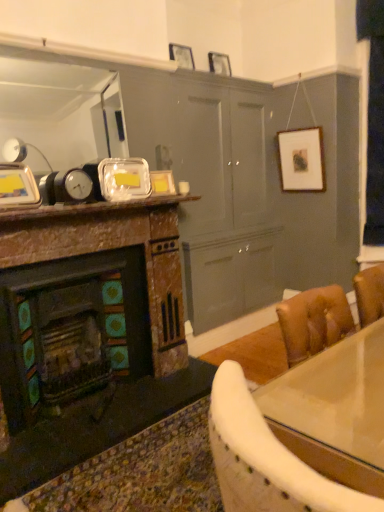
Describe the element at coordinates (88, 300) in the screenshot. I see `rustic stone fireplace at left` at that location.

The image size is (384, 512). I want to click on rustic stone fireplace at left, so click(x=88, y=300).

What do you see at coordinates (183, 188) in the screenshot?
I see `white glossy coffee cup at center` at bounding box center [183, 188].

What is the approximate width of wooden picture frame at upper center, arranged as the 3th picture frame when viewed from the left?

wooden picture frame at upper center, arranged as the 3th picture frame when viewed from the left, is 2.19 inches in width.

What do you see at coordinates (162, 182) in the screenshot? This screenshot has height=512, width=384. I see `matte glass picture frame at upper center, the second picture frame when ordered from front to back` at bounding box center [162, 182].

This screenshot has height=512, width=384. I want to click on shiny glass table at lower right, so click(x=335, y=396).

Considering the relative positions of rustic stone fireplace at left and shiny glass table at lower right in the image provided, is rustic stone fireplace at left to the left of shiny glass table at lower right from the viewer's perspective?

Indeed, rustic stone fireplace at left is positioned on the left side of shiny glass table at lower right.

Which object is further away from the camera taking this photo, rustic stone fireplace at left or shiny glass table at lower right?

rustic stone fireplace at left is more distant.

Looking at this image, is rustic stone fireplace at left looking in the opposite direction of shiny glass table at lower right?

rustic stone fireplace at left does not have its back to shiny glass table at lower right.

Identify the location of cabinetry that is under the shiny glass table at lower right (from a real-world perspective). (88, 300).

From a real-world perspective, is matte glass picture frame at upper center, marked as the fourth picture frame in a right-to-left arrangement, physically above white glossy coffee cup at center?

Yes, from a real-world perspective, matte glass picture frame at upper center, marked as the fourth picture frame in a right-to-left arrangement, is on top of white glossy coffee cup at center.

How many degrees apart are the facing directions of matte glass picture frame at upper center, marked as the second picture frame in a bottom-to-top arrangement, and white glossy coffee cup at center?

There is a 17.9-degree angle between the facing directions of matte glass picture frame at upper center, marked as the second picture frame in a bottom-to-top arrangement, and white glossy coffee cup at center.

Is point (156, 180) more distant than point (182, 184)?

No, it is not.

In the scene shown: Is matte glass picture frame at upper center, which is counted as the 4th picture frame, starting from the top, inside or outside of white glossy coffee cup at center?

matte glass picture frame at upper center, which is counted as the 4th picture frame, starting from the top, cannot be found inside white glossy coffee cup at center.

Are white glossy coffee cup at center and metallic silver picture frame at upper left, the 5th picture frame when ordered from back to front, located far from each other?

Indeed, white glossy coffee cup at center is not near metallic silver picture frame at upper left, the 5th picture frame when ordered from back to front.

Is white glossy coffee cup at center to the right of metallic silver picture frame at upper left, placed as the 1th picture frame when sorted from front to back, from the viewer's perspective?

Correct, you'll find white glossy coffee cup at center to the right of metallic silver picture frame at upper left, placed as the 1th picture frame when sorted from front to back.

How far apart are white glossy coffee cup at center and metallic silver picture frame at upper left, the 5th picture frame when ordered from back to front?

A distance of 1.05 meters exists between white glossy coffee cup at center and metallic silver picture frame at upper left, the 5th picture frame when ordered from back to front.

Is white glossy coffee cup at center facing away from metallic silver picture frame at upper left, the 1th picture frame from the bottom?

No, white glossy coffee cup at center is not facing the opposite direction of metallic silver picture frame at upper left, the 1th picture frame from the bottom.

Measure the distance between matte glass picture frame at upper center, which is the second picture frame in left-to-right order, and shiny glass table at lower right.

The distance of matte glass picture frame at upper center, which is the second picture frame in left-to-right order, from shiny glass table at lower right is 1.65 meters.

Is point (169, 190) farther from viewer compared to point (362, 387)?

Yes, point (169, 190) is farther from viewer.

From the image's perspective, is matte glass picture frame at upper center, the second picture frame when ordered from front to back, above shiny glass table at lower right?

Yes, from the image's perspective, matte glass picture frame at upper center, the second picture frame when ordered from front to back, is above shiny glass table at lower right.

In terms of height, does matte glass picture frame at upper center, which is the second picture frame in left-to-right order, look taller or shorter compared to shiny glass table at lower right?

In the image, matte glass picture frame at upper center, which is the second picture frame in left-to-right order, appears to be shorter than shiny glass table at lower right.

From a real-world perspective, is matte glass picture frame at upper center, marked as the second picture frame in a bottom-to-top arrangement, above or below wooden picture frame at upper right, arranged as the first picture frame when viewed from the right?

matte glass picture frame at upper center, marked as the second picture frame in a bottom-to-top arrangement, is below wooden picture frame at upper right, arranged as the first picture frame when viewed from the right.

This screenshot has height=512, width=384. There is a wooden picture frame at upper right, arranged as the first picture frame when viewed from the right. Identify the location of the 1st picture frame below it (from the image's perspective). (162, 182).

Between matte glass picture frame at upper center, the second picture frame when ordered from front to back, and wooden picture frame at upper right, the second picture frame when ordered from back to front, which one has larger size?

Bigger between the two is wooden picture frame at upper right, the second picture frame when ordered from back to front.

Considering the sizes of objects matte glass picture frame at upper center, marked as the second picture frame in a bottom-to-top arrangement, and wooden picture frame at upper right, positioned as the 4th picture frame in front-to-back order, in the image provided, who is wider, matte glass picture frame at upper center, marked as the second picture frame in a bottom-to-top arrangement, or wooden picture frame at upper right, positioned as the 4th picture frame in front-to-back order,?

With larger width is wooden picture frame at upper right, positioned as the 4th picture frame in front-to-back order.

From a real-world perspective, is rustic stone fireplace at left under matte glass picture frame at upper center, which is the second picture frame in left-to-right order?

Correct, in the physical world, rustic stone fireplace at left is lower than matte glass picture frame at upper center, which is the second picture frame in left-to-right order.

Considering the positions of points (113, 370) and (173, 187), is point (113, 370) closer to camera compared to point (173, 187)?

No.

Based on the photo, is rustic stone fireplace at left in contact with matte glass picture frame at upper center, which is counted as the 4th picture frame, starting from the top?

No, rustic stone fireplace at left is not next to matte glass picture frame at upper center, which is counted as the 4th picture frame, starting from the top.

From the image's perspective, is rustic stone fireplace at left above or below matte glass picture frame at upper center, which is counted as the 4th picture frame, starting from the top?

rustic stone fireplace at left is below matte glass picture frame at upper center, which is counted as the 4th picture frame, starting from the top.

In the scene shown: From the image's perspective, is wooden picture frame at upper center, which ranks as the 3th picture frame in back-to-front order, located above or below rustic stone fireplace at left?

Clearly, from the image's perspective, wooden picture frame at upper center, which ranks as the 3th picture frame in back-to-front order, is above rustic stone fireplace at left.

Does wooden picture frame at upper center, which ranks as the 3th picture frame in back-to-front order, have a larger size compared to rustic stone fireplace at left?

Incorrect, wooden picture frame at upper center, which ranks as the 3th picture frame in back-to-front order, is not larger than rustic stone fireplace at left.

Is wooden picture frame at upper center, arranged as the 3th picture frame when viewed from the left, looking in the opposite direction of rustic stone fireplace at left?

No, wooden picture frame at upper center, arranged as the 3th picture frame when viewed from the left, is not facing away from rustic stone fireplace at left.

Locate an element on the screen. This screenshot has height=512, width=384. counter top above the rustic stone fireplace at left (from a real-world perspective) is located at coordinates (335, 396).

From the white glossy coffee cup at center, count the 2nd picture frame to the left and point to it. Please provide its 2D coordinates.

[(162, 182)]

When comparing their distances from matte silver picture frame at upper center, which is counted as the first picture frame, starting from the back, does white glossy coffee cup at center or matte glass picture frame at upper center, marked as the second picture frame in a bottom-to-top arrangement, seem closer?

white glossy coffee cup at center.

From the image, which object appears to be nearer to wooden picture frame at upper center, which is the second picture frame in top-to-bottom order, matte glass picture frame at upper center, which is the 4th picture frame from back to front, or metallic silver picture frame at upper left, the 1th picture frame from the bottom?

matte glass picture frame at upper center, which is the 4th picture frame from back to front.

Which object lies further to the anchor point rustic stone fireplace at left, wooden picture frame at upper center, the third picture frame positioned from the front, or shiny glass table at lower right?

wooden picture frame at upper center, the third picture frame positioned from the front, lies further to rustic stone fireplace at left than the other object.

Which object lies nearer to the anchor point white glossy coffee cup at center, rustic stone fireplace at left or matte silver picture frame at upper center, the fifth picture frame from the bottom?

Based on the image, rustic stone fireplace at left appears to be nearer to white glossy coffee cup at center.

When comparing their distances from white glossy coffee cup at center, does shiny glass table at lower right or wooden picture frame at upper center, the third picture frame viewed from the right, seem closer?

Based on the image, wooden picture frame at upper center, the third picture frame viewed from the right, appears to be nearer to white glossy coffee cup at center.

When comparing their distances from shiny glass table at lower right, does wooden picture frame at upper center, arranged as the 3th picture frame when viewed from the left, or rustic stone fireplace at left seem further?

The object further to shiny glass table at lower right is wooden picture frame at upper center, arranged as the 3th picture frame when viewed from the left.

Which object lies nearer to the anchor point metallic silver picture frame at upper left, the 1th picture frame from the bottom, matte silver picture frame at upper center, which is counted as the first picture frame, starting from the back, or matte glass picture frame at upper center, marked as the second picture frame in a bottom-to-top arrangement?

matte glass picture frame at upper center, marked as the second picture frame in a bottom-to-top arrangement.

Based on their spatial positions, is white glossy coffee cup at center or shiny glass table at lower right further from metallic silver picture frame at upper left, placed as the 1th picture frame when sorted from front to back?

Based on the image, shiny glass table at lower right appears to be further to metallic silver picture frame at upper left, placed as the 1th picture frame when sorted from front to back.

This screenshot has height=512, width=384. I want to click on coffee cup located between metallic silver picture frame at upper left, which ranks as the 5th picture frame in top-to-bottom order, and matte silver picture frame at upper center, marked as the 1th picture frame in a top-to-bottom arrangement, in the depth direction, so click(x=183, y=188).

Identify the location of coffee cup between metallic silver picture frame at upper left, arranged as the 5th picture frame when viewed from the right, and wooden picture frame at upper center, arranged as the 3th picture frame when viewed from the left, in the front-back direction. (183, 188).

This screenshot has width=384, height=512. What are the coordinates of `coffee cup located between matte glass picture frame at upper center, marked as the second picture frame in a bottom-to-top arrangement, and wooden picture frame at upper right, positioned as the 4th picture frame in front-to-back order, in the left-right direction` in the screenshot? It's located at (183, 188).

Image resolution: width=384 pixels, height=512 pixels. Find the location of `cabinetry between metallic silver picture frame at upper left, arranged as the 5th picture frame when viewed from the right, and wooden picture frame at upper right, which is the third picture frame from top to bottom, in the horizontal direction`. cabinetry between metallic silver picture frame at upper left, arranged as the 5th picture frame when viewed from the right, and wooden picture frame at upper right, which is the third picture frame from top to bottom, in the horizontal direction is located at coordinates (88, 300).